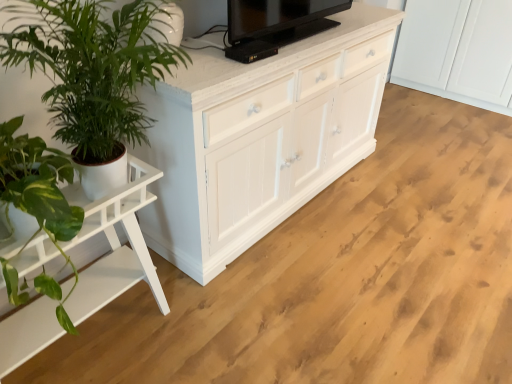
Question: Is black glossy tv at upper center taller or shorter than green leafy plant at left?

Choices:
 (A) tall
 (B) short

Answer: (B)

Question: Considering the relative positions of black glossy tv at upper center and green leafy plant at left in the image provided, is black glossy tv at upper center to the left or to the right of green leafy plant at left?

Choices:
 (A) left
 (B) right

Answer: (B)

Question: Which of these objects is positioned closest to the black glossy tv at upper center?

Choices:
 (A) white wood table at left
 (B) green leafy plant at left

Answer: (B)

Question: Considering the real-world distances, which object is closest to the green leafy plant at left?

Choices:
 (A) white wood table at left
 (B) black glossy tv at upper center

Answer: (A)